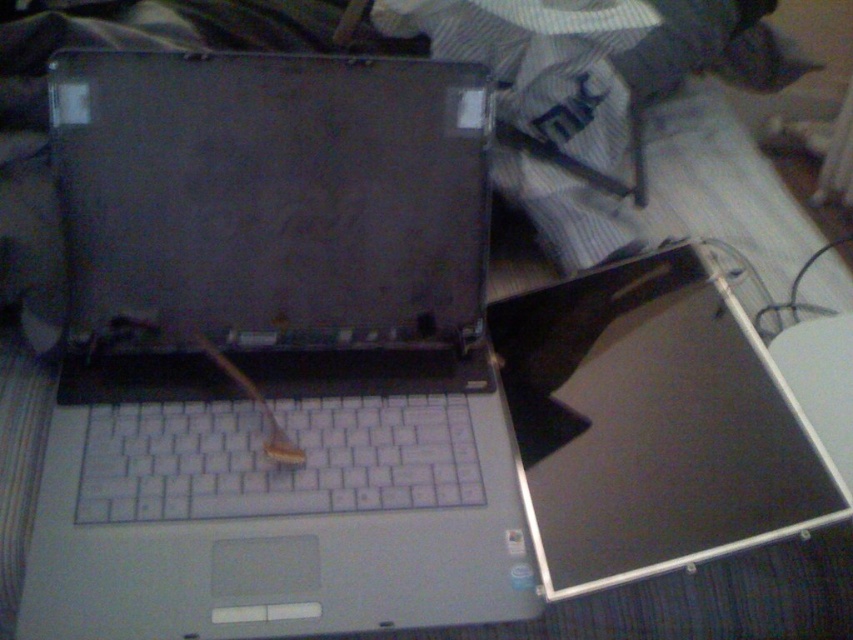
You are a technician working on the laptop. You have two points marked on the laptop screen. The first point is at coordinates point (200, 355) and the second is at point (549, 301). Which point is closer to the camera?

Point (200, 355) is closer to the camera than point (549, 301).

You are a technician trying to access the screen area of the satin silver laptop at center. You notice the satin black screen at center is blocking your view. Can you move the screen upwards to see the internal components better?

The satin silver laptop at center is located above the satin black screen at center, so moving the screen upwards may not be possible since the laptop itself is already positioned above the screen.